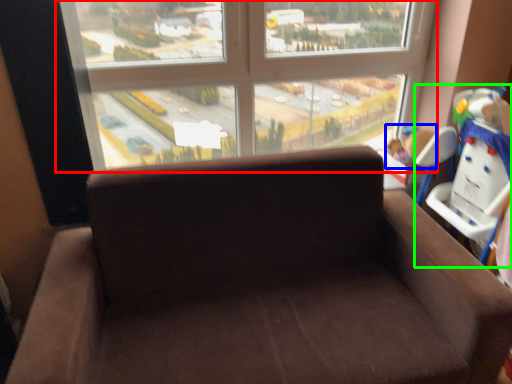
Question: Considering the real-world distances, which object is farthest from window (highlighted by a red box)? child (highlighted by a blue box) or baby carriage (highlighted by a green box)?

Choices:
 (A) child
 (B) baby carriage

Answer: (B)